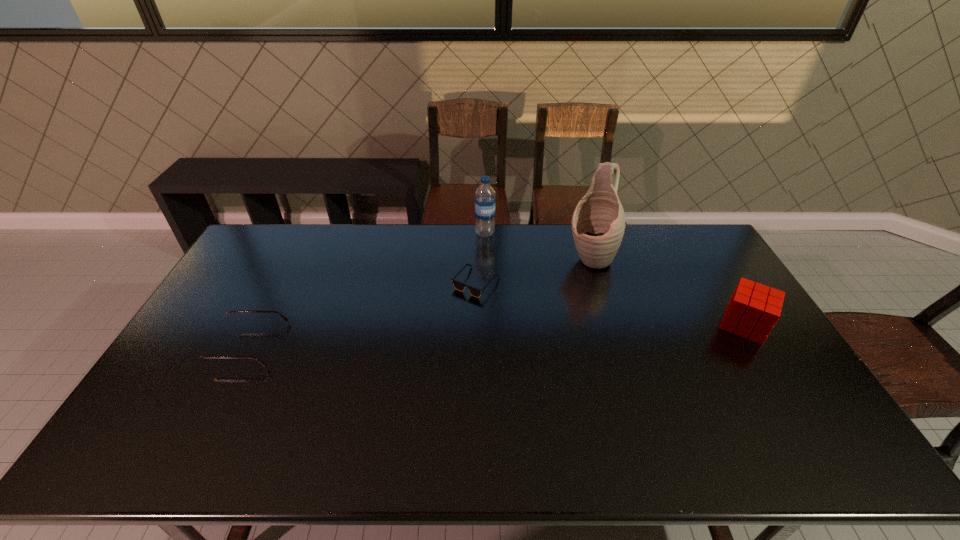
Where is `free space on the desktop that is between the leftmost object and the cube and is positioned at the spout of the pitcher`? The width and height of the screenshot is (960, 540). free space on the desktop that is between the leftmost object and the cube and is positioned at the spout of the pitcher is located at coordinates (549, 333).

At what (x,y) coordinates should I click in order to perform the action: click on free space on the desktop that is between the leftmost object and the rightmost object and is positioned on the lenses of the sunglasses. Please return your answer as a coordinate pair (x, y). Looking at the image, I should click on (472, 336).

At what (x,y) coordinates should I click in order to perform the action: click on free spot on the desktop that is between the second shortest object and the third shortest object and is positioned on the label of the second tallest object. Please return your answer as a coordinate pair (x, y). This screenshot has height=540, width=960. Looking at the image, I should click on (489, 335).